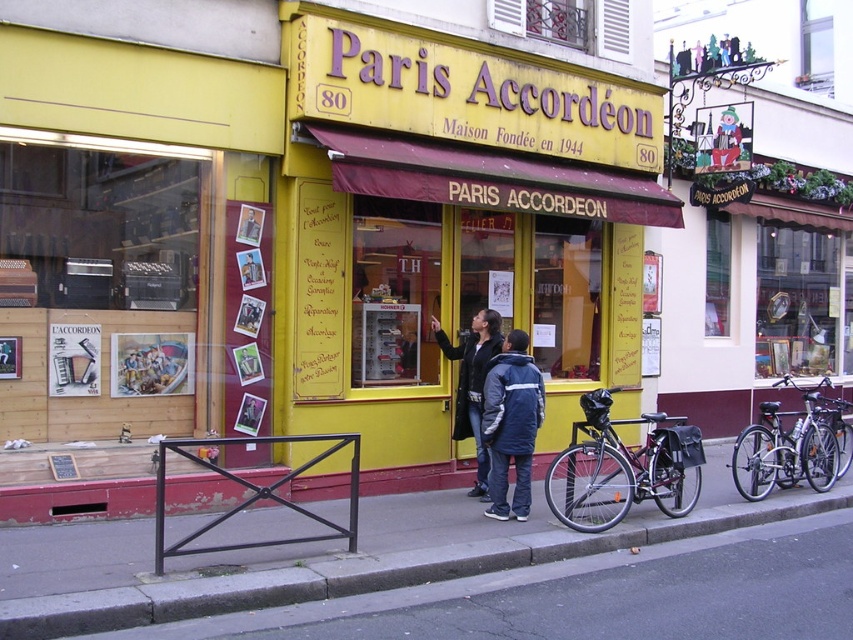
Question: Considering the relative positions of dark blue jacket at center and silver metallic bicycle at right in the image provided, where is dark blue jacket at center located with respect to silver metallic bicycle at right?

Choices:
 (A) right
 (B) left

Answer: (B)

Question: Does black matte bicycle at center have a lesser width compared to silver metallic bicycle at right?

Choices:
 (A) no
 (B) yes

Answer: (A)

Question: Is black matte bicycle at center below silver metallic bicycle at right?

Choices:
 (A) yes
 (B) no

Answer: (B)

Question: Which object appears closest to the camera in this image?

Choices:
 (A) concrete sidewalk at center
 (B) dark blue jacket at center
 (C) black matte bicycle at center
 (D) blue nylon jacket at center

Answer: (A)

Question: Which of the following is the closest to the observer?

Choices:
 (A) (599, 477)
 (B) (773, 472)

Answer: (B)

Question: Which point appears farthest from the camera in this image?

Choices:
 (A) (593, 524)
 (B) (503, 356)

Answer: (B)